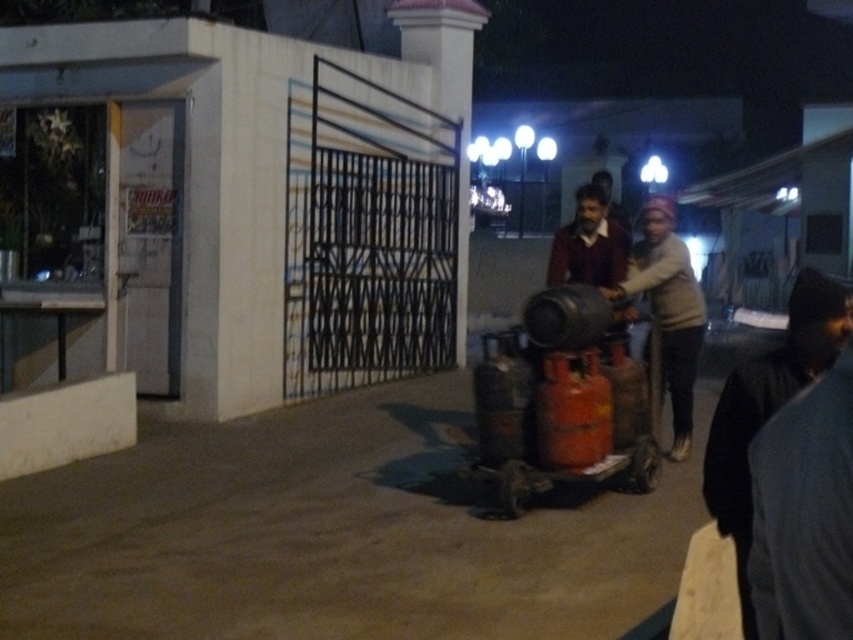
Question: Which of the following is the farthest from the observer?

Choices:
 (A) (457, 225)
 (B) (747, 468)

Answer: (A)

Question: Is black fabric at lower right positioned at the back of white concrete pillar at center?

Choices:
 (A) no
 (B) yes

Answer: (A)

Question: Which point is closer to the camera?

Choices:
 (A) (753, 376)
 (B) (689, 310)
 (C) (469, 29)

Answer: (A)

Question: From the image, what is the correct spatial relationship of black fabric at lower right in relation to white concrete pillar at center?

Choices:
 (A) right
 (B) left

Answer: (A)

Question: Considering the real-world distances, which object is farthest from the white concrete pillar at center?

Choices:
 (A) light gray cotton sweater at center
 (B) black fabric at lower right

Answer: (B)

Question: Is light gray cotton sweater at center bigger than white concrete pillar at center?

Choices:
 (A) yes
 (B) no

Answer: (B)